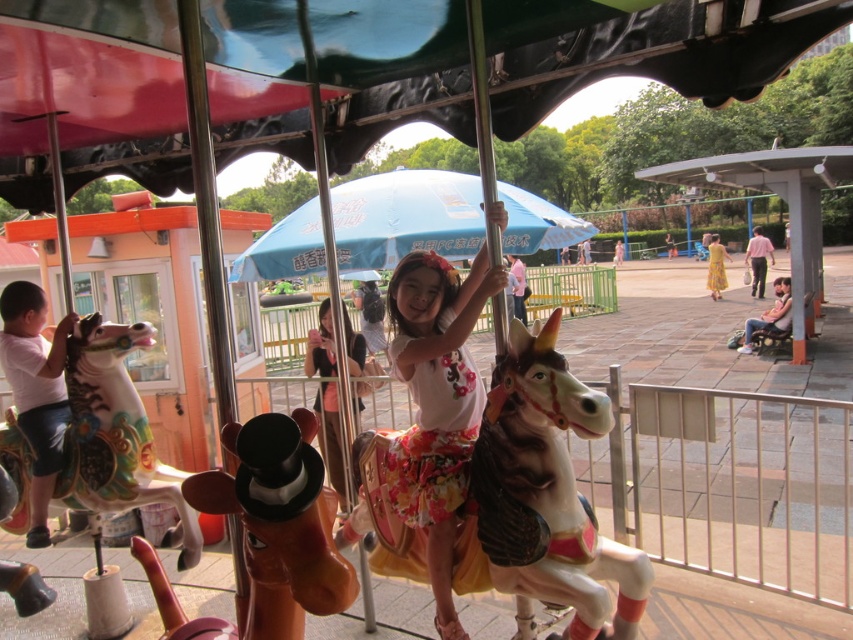
Does white glossy horse at center have a smaller size compared to floral cotton dress at center?

No.

Which is more to the right, white glossy horse at center or floral cotton dress at center?

white glossy horse at center

Which is in front, point (527, 401) or point (476, 276)?

Point (527, 401)

The image size is (853, 640). Find the location of `white glossy horse at center`. white glossy horse at center is located at coordinates (543, 499).

Is the position of white glossy horse at center more distant than that of floral fabric dress at center?

That is False.

Between point (625, 556) and point (335, 388), which one is positioned behind?

The point (335, 388) is more distant.

Identify the location of white glossy horse at center. The image size is (853, 640). (543, 499).

Is white glossy horse at center closer to camera compared to painted wood horse at left?

Yes, it is.

Does white glossy horse at center have a greater width compared to painted wood horse at left?

Yes, white glossy horse at center is wider than painted wood horse at left.

Between point (538, 499) and point (74, 476), which one is positioned in front?

Point (538, 499)

Locate an element on the screen. This screenshot has width=853, height=640. white glossy horse at center is located at coordinates (543, 499).